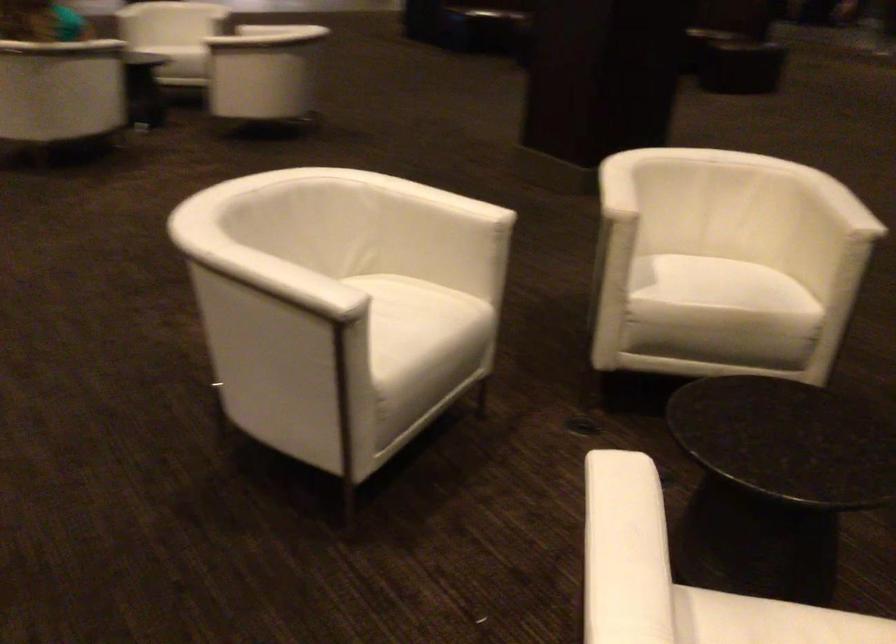
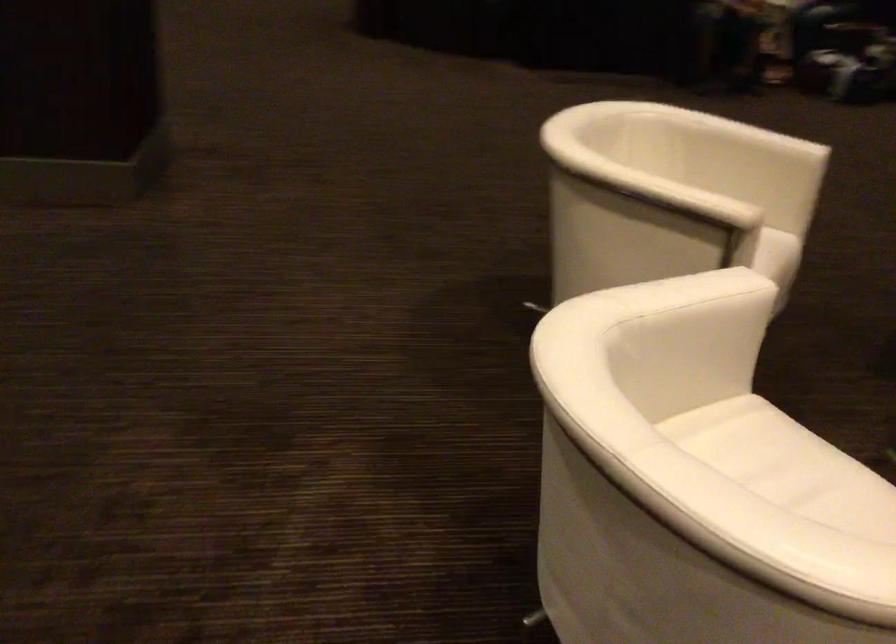
Where in the second image is the point corresponding to [602,245] from the first image?

(676, 261)